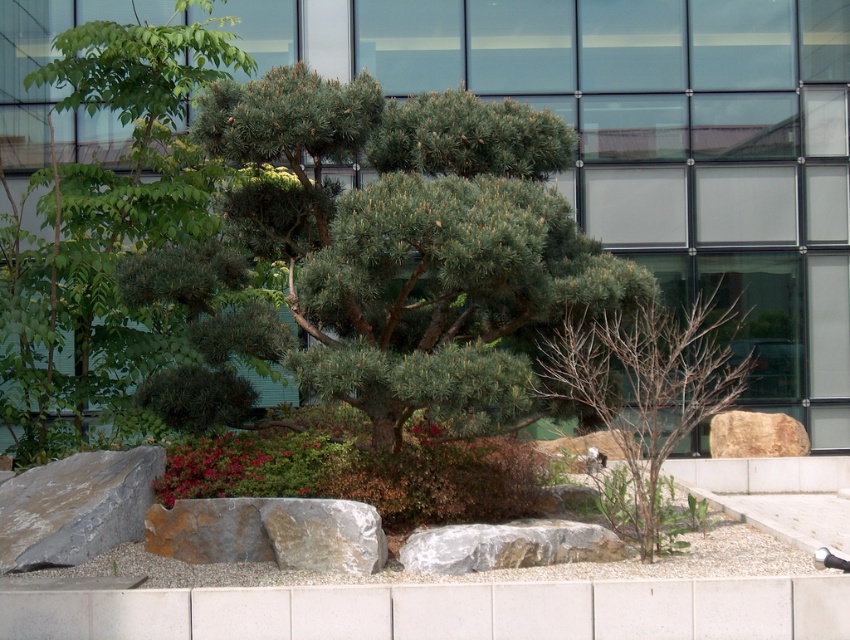
Is bare wood tree at center positioned at the back of smooth gray rock at center?

Yes, bare wood tree at center is behind smooth gray rock at center.

Which is in front, point (728, 380) or point (354, 568)?

Point (354, 568) is more forward.

Which is behind, point (646, 328) or point (333, 502)?

The point (646, 328) is more distant.

The image size is (850, 640). What are the coordinates of `bare wood tree at center` in the screenshot? It's located at (646, 392).

Who is taller, gray gravel at lower center or gray/rough rock at center?

Standing taller between the two is gray/rough rock at center.

Does point (517, 579) come closer to viewer compared to point (547, 556)?

Yes, point (517, 579) is closer to viewer.

Which is in front, point (153, 557) or point (486, 554)?

Point (486, 554) is in front.

At what (x,y) coordinates should I click in order to perform the action: click on gray gravel at lower center. Please return your answer as a coordinate pair (x, y). The image size is (850, 640). Looking at the image, I should click on (466, 573).

What do you see at coordinates (105, 224) in the screenshot? I see `green leafy tree at upper left` at bounding box center [105, 224].

Based on the photo, is green leafy tree at upper left closer to camera compared to gray rough rock at lower left?

No.

Does point (68, 230) come closer to viewer compared to point (128, 515)?

No, (68, 230) is further to viewer.

Find the location of a particular element. green leafy tree at upper left is located at coordinates (105, 224).